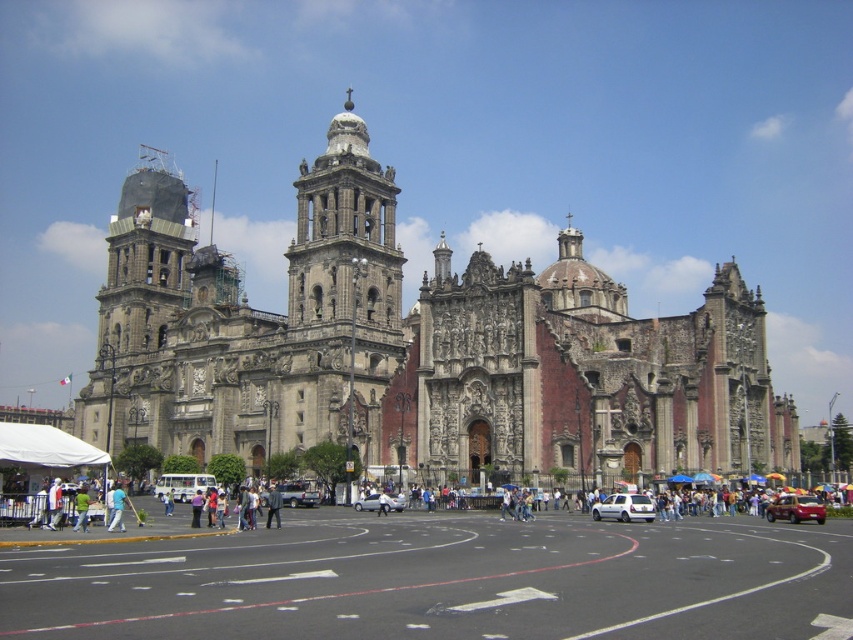
You are a tour guide leading a group near the cathedral. You need to park your metallic red car at center in a designated parking spot marked by white lines. Can you confirm if the car is currently positioned within the parking area?

The metallic red car at center is located at point (796, 508), which is outside the parking area marked by white lines. Please move it to the designated spot.

You are driving a car and need to park in the area in front of the cathedral. You see a silver metallic sedan at center and a white matte car at center. Which car is positioned to the left side when viewed from the front of the cathedral?

The silver metallic sedan at center is positioned to the left of the white matte car at center.